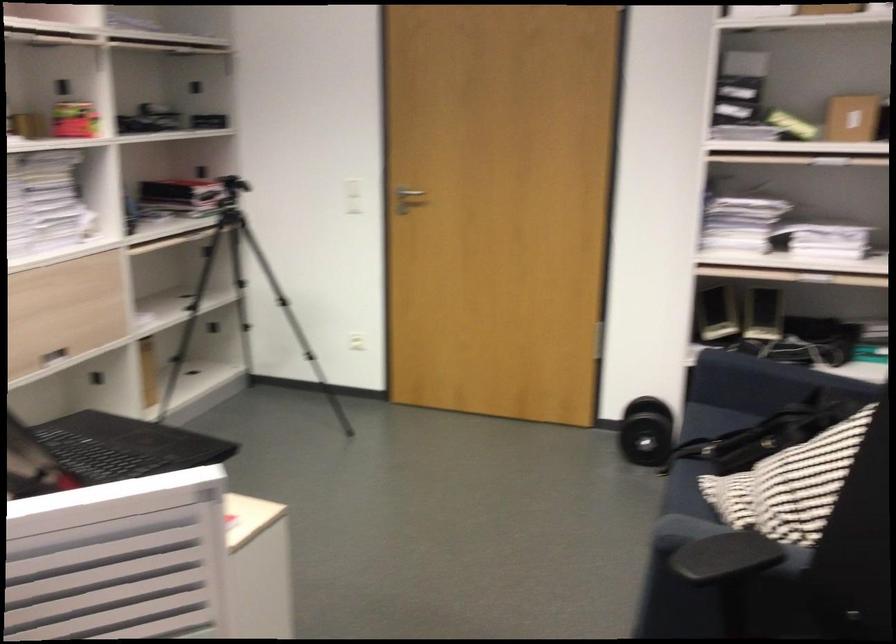
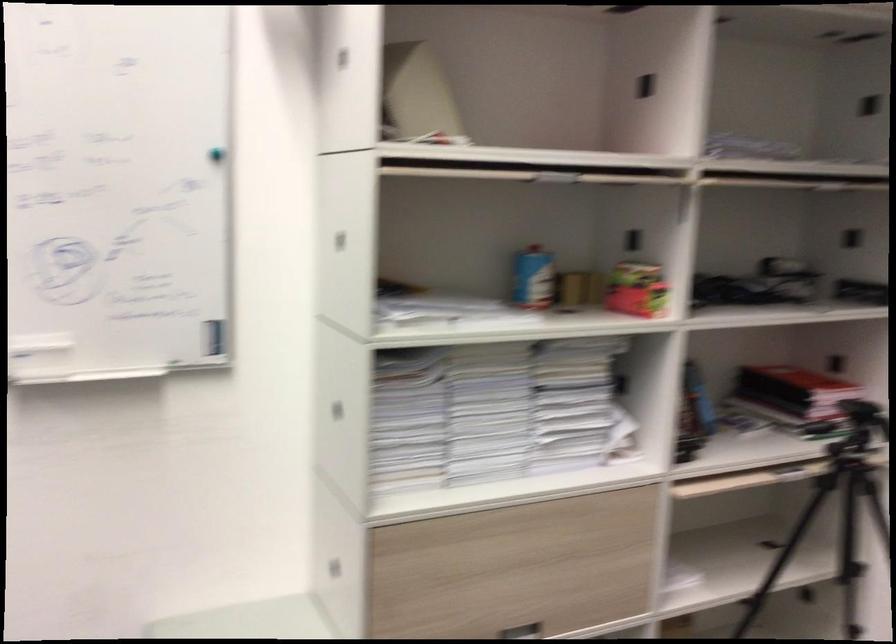
Find the pixel in the second image that matches pixel 143 319 in the first image.

(678, 581)